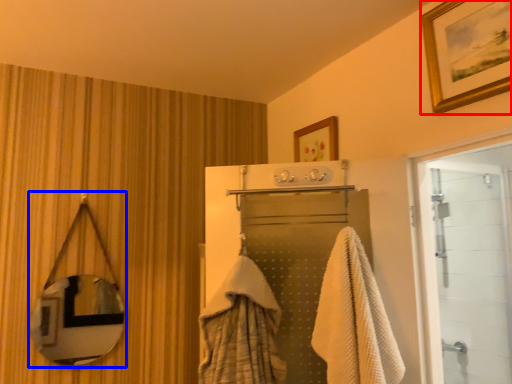
Question: Among these objects, which one is nearest to the camera, picture frame (highlighted by a red box) or mirror (highlighted by a blue box)?

Choices:
 (A) picture frame
 (B) mirror

Answer: (A)